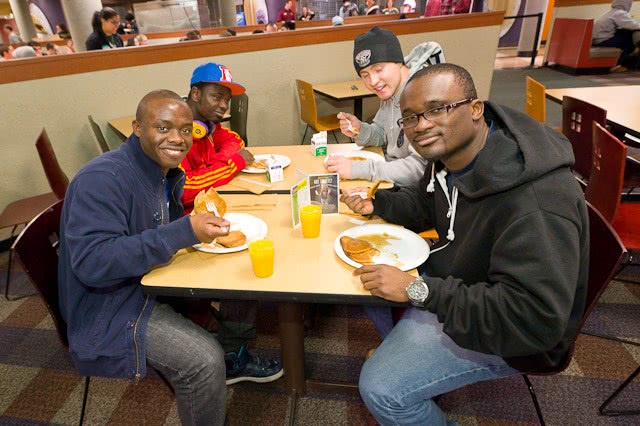
You are a GUI agent. You are given a task and a screenshot of the screen. Output one action in this format:
    pyautogui.click(x=<x>, y=<y>)
    Task: Click on the white plate on tabletop
    
    Given the screenshot: What is the action you would take?
    (x=250, y=225), (x=408, y=247), (x=372, y=155), (x=276, y=159)